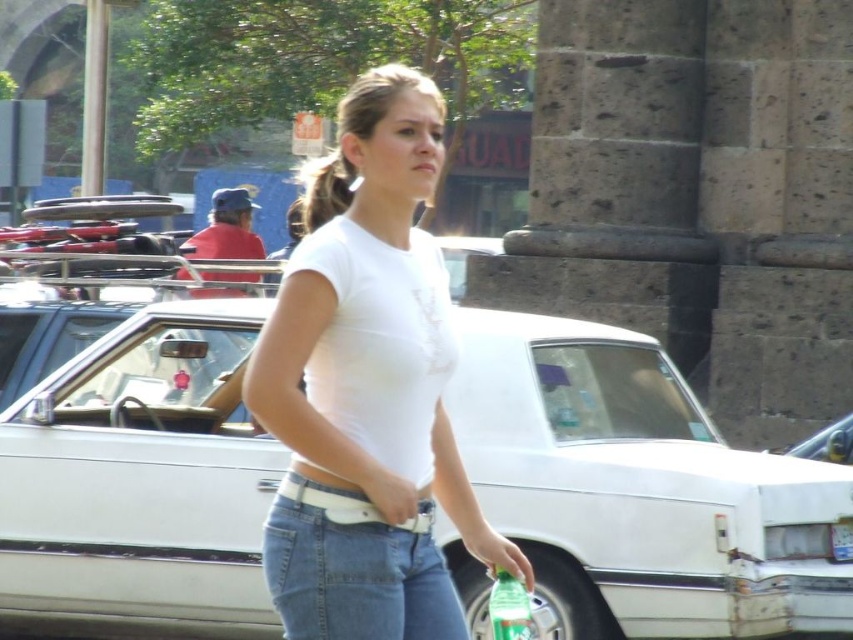
Does white matte car at center have a greater height compared to blonde hair at center?

In fact, white matte car at center may be shorter than blonde hair at center.

Does point (270, 632) lie in front of point (292, 234)?

Yes, it is in front of point (292, 234).

Locate an element on the screen. white matte car at center is located at coordinates (640, 490).

Locate an element on the screen. This screenshot has width=853, height=640. white matte car at center is located at coordinates (640, 490).

Between white matte car at center and white matte t-shirt at center, which one has less height?

With less height is white matte car at center.

The image size is (853, 640). I want to click on white matte car at center, so click(x=640, y=490).

Who is more distant from viewer, (x=375, y=486) or (x=299, y=220)?

The point (x=299, y=220) is more distant.

Who is taller, white matte t-shirt at center or blonde hair at center?

With more height is blonde hair at center.

Is point (303, 435) closer to camera compared to point (293, 232)?

Yes, point (303, 435) is closer to viewer.

Find the location of a particular element. This screenshot has height=640, width=853. white matte t-shirt at center is located at coordinates (368, 394).